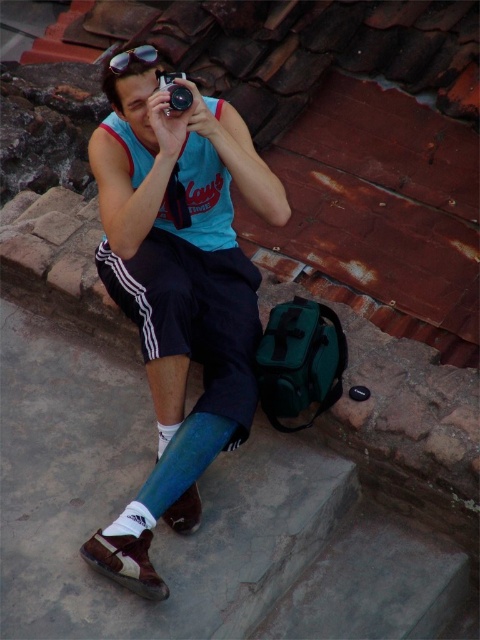
Does black plastic camera at center appear over shiny plastic goggles at upper center?

Actually, black plastic camera at center is below shiny plastic goggles at upper center.

Can you confirm if black plastic camera at center is wider than shiny plastic goggles at upper center?

No.

Image resolution: width=480 pixels, height=640 pixels. Describe the element at coordinates (175, 90) in the screenshot. I see `black plastic camera at center` at that location.

The width and height of the screenshot is (480, 640). What are the coordinates of `black plastic camera at center` in the screenshot? It's located at (175, 90).

Locate an element on the screen. blue fabric shorts at center is located at coordinates (178, 292).

Which of these two, blue fabric shorts at center or black plastic camera at center, stands taller?

blue fabric shorts at center is taller.

Locate an element on the screen. This screenshot has height=640, width=480. blue fabric shorts at center is located at coordinates (178, 292).

The height and width of the screenshot is (640, 480). What are the coordinates of `blue fabric shorts at center` in the screenshot? It's located at (178, 292).

Image resolution: width=480 pixels, height=640 pixels. What do you see at coordinates (178, 292) in the screenshot?
I see `blue fabric shorts at center` at bounding box center [178, 292].

Is point (215, 112) in front of point (145, 44)?

That is True.

You are a GUI agent. You are given a task and a screenshot of the screen. Output one action in this format:
    pyautogui.click(x=<x>, y=<y>)
    Task: Click on the blue fabric shorts at center
    This screenshot has height=640, width=480.
    Given the screenshot: What is the action you would take?
    pyautogui.click(x=178, y=292)